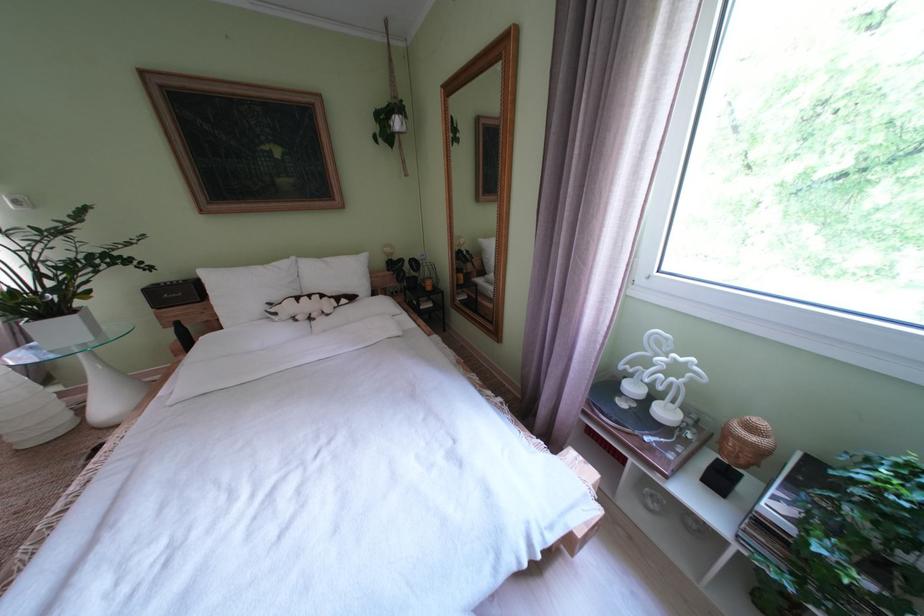
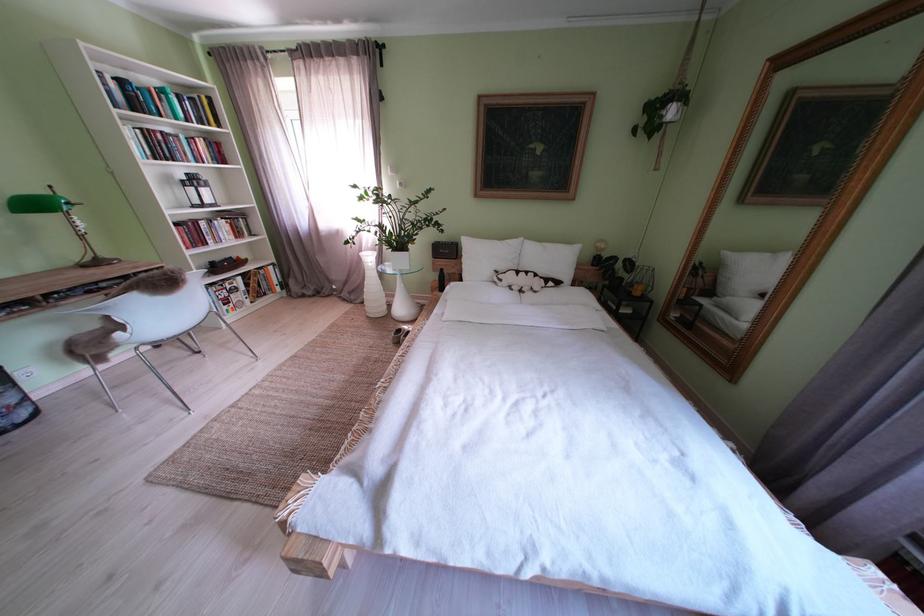
Find the pixel in the second image that matches (286,318) in the first image.

(512, 285)